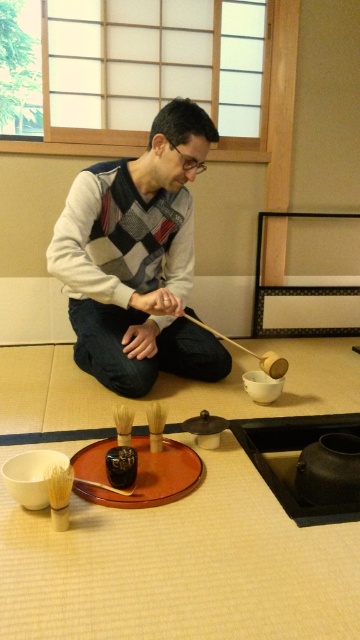
Question: Does knit sweater at center appear on the left side of brown wooden tray at center?

Choices:
 (A) no
 (B) yes

Answer: (B)

Question: Does brown wooden tray at center appear over wooden mallet at center?

Choices:
 (A) yes
 (B) no

Answer: (B)

Question: Considering the real-world distances, which object is closest to the knit sweater at center?

Choices:
 (A) brown wooden brush at center
 (B) wooden mallet at center

Answer: (B)

Question: Can you confirm if knit sweater at center is bigger than brown wooden brush at center?

Choices:
 (A) yes
 (B) no

Answer: (A)

Question: Which point appears farthest from the camera in this image?

Choices:
 (A) (195, 468)
 (B) (92, 301)

Answer: (B)

Question: Considering the real-world distances, which object is farthest from the brown wooden tray at center?

Choices:
 (A) wooden mallet at center
 (B) knit sweater at center
 (C) brown wooden brush at center

Answer: (A)